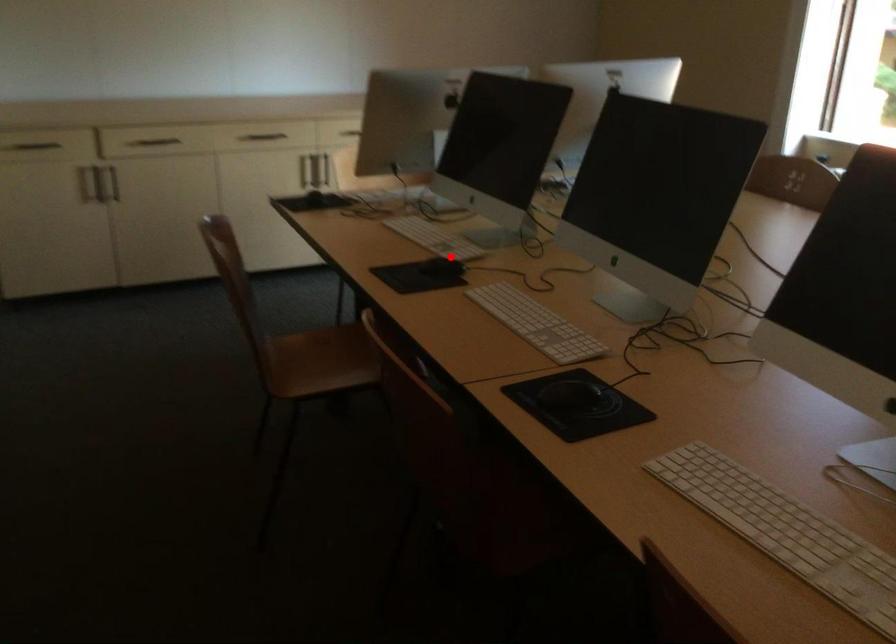
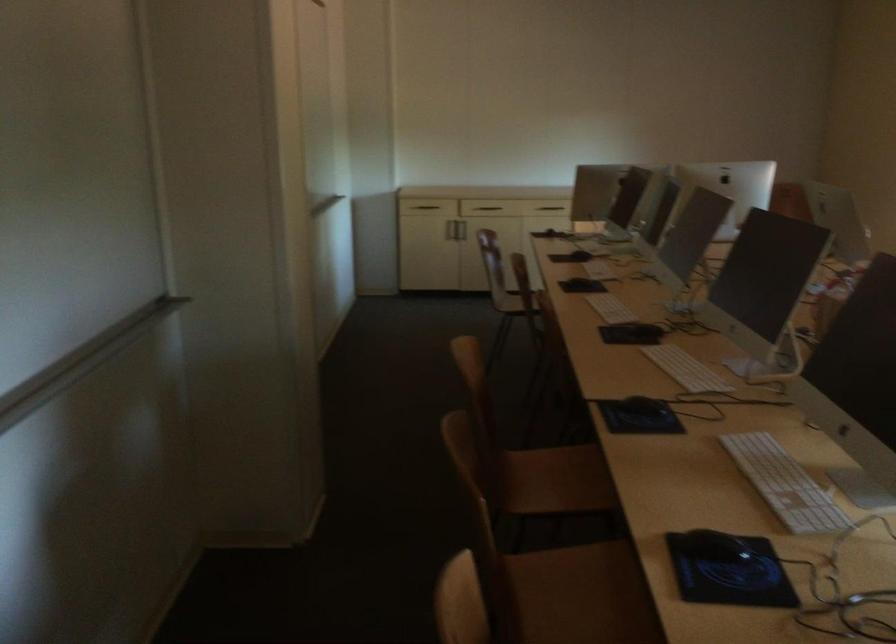
In the second image, find the point that corresponds to the highlighted location in the first image.

(593, 245)